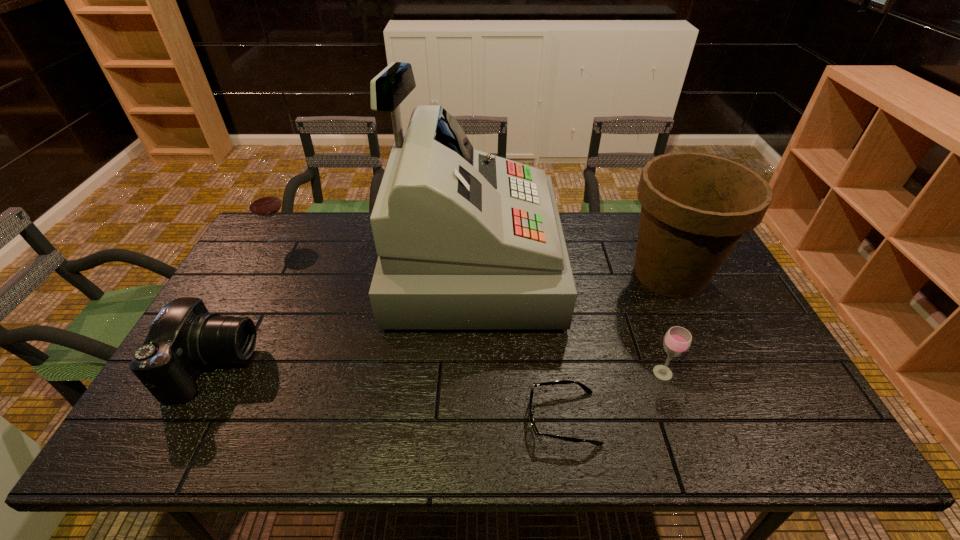
Find the location of a particular element. blank area located 0.060m on the right of the taller wineglass is located at coordinates (311, 240).

At what (x,y) coordinates should I click in order to perform the action: click on vacant space positioned on the lens of the camera. Please return your answer as a coordinate pair (x, y). Looking at the image, I should click on (284, 366).

What are the coordinates of `free space located on the right of the shorter wineglass` in the screenshot? It's located at (702, 373).

Locate an element on the screen. The image size is (960, 540). free space located 0.250m on the front-facing side of the shortest object is located at coordinates (421, 418).

This screenshot has width=960, height=540. I want to click on free space located on the front-facing side of the shortest object, so click(507, 418).

Locate an element on the screen. The image size is (960, 540). vacant space positioned 0.060m on the front-facing side of the shortest object is located at coordinates (503, 418).

Where is `cash register present at the far edge`? This screenshot has width=960, height=540. cash register present at the far edge is located at coordinates (466, 240).

Find the location of a particular element. flowerpot positioned at the far edge is located at coordinates (695, 207).

The width and height of the screenshot is (960, 540). I want to click on wineglass located in the far edge section of the desktop, so (x=264, y=202).

The height and width of the screenshot is (540, 960). I want to click on object at the near edge, so click(585, 388).